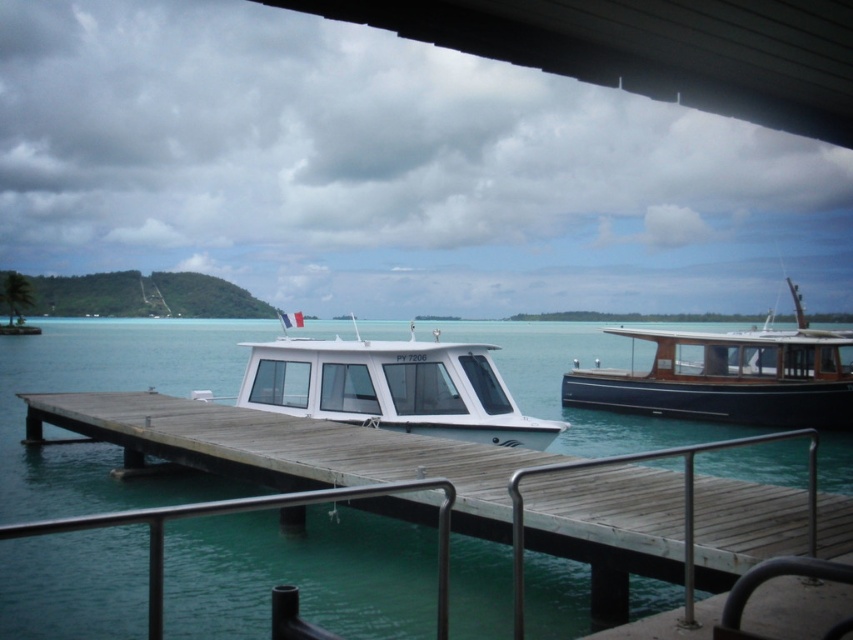
Which of these two, clear blue water at center or dark blue polished wood boat at right, stands taller?

Standing taller between the two is dark blue polished wood boat at right.

This screenshot has width=853, height=640. Describe the element at coordinates (109, 390) in the screenshot. I see `clear blue water at center` at that location.

In order to click on clear blue water at center in this screenshot , I will do `click(109, 390)`.

Is white glossy boat at center bigger than dark blue polished wood boat at right?

Actually, white glossy boat at center might be smaller than dark blue polished wood boat at right.

Does white glossy boat at center have a greater width compared to dark blue polished wood boat at right?

No.

Identify the location of white glossy boat at center. The height and width of the screenshot is (640, 853). click(392, 387).

I want to click on white glossy boat at center, so click(x=392, y=387).

Is the position of clear blue water at center less distant than that of white glossy boat at center?

Yes, it is in front of white glossy boat at center.

Between point (537, 342) and point (474, 422), which one is positioned behind?

Positioned behind is point (537, 342).

Is point (109, 632) in front of point (357, 408)?

Yes, it is in front of point (357, 408).

Identify the location of clear blue water at center. (109, 390).